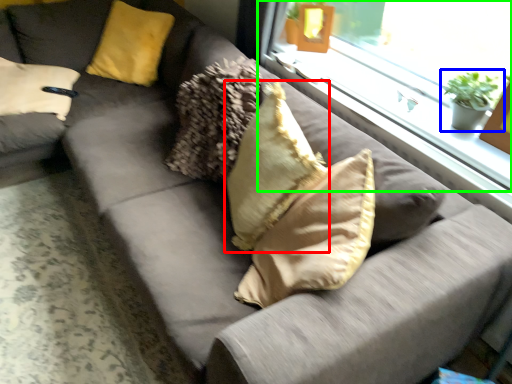
Question: Considering the real-world distances, which object is closest to pillow (highlighted by a red box)? houseplant (highlighted by a blue box) or window (highlighted by a green box).

Choices:
 (A) houseplant
 (B) window

Answer: (B)